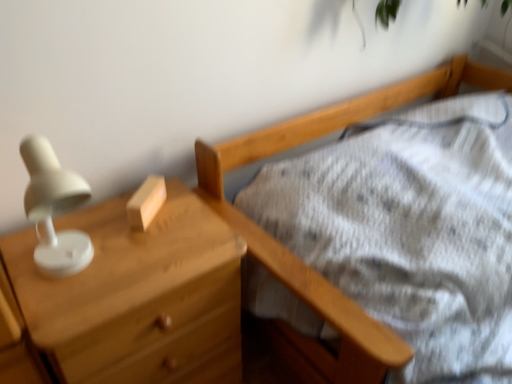
Question: Considering the relative sizes of wooden block at center and matte wood chest of drawers at left in the image provided, is wooden block at center bigger than matte wood chest of drawers at left?

Choices:
 (A) yes
 (B) no

Answer: (B)

Question: Is the depth of wooden block at center less than that of matte wood chest of drawers at left?

Choices:
 (A) no
 (B) yes

Answer: (A)

Question: Are wooden block at center and matte wood chest of drawers at left making contact?

Choices:
 (A) yes
 (B) no

Answer: (B)

Question: From the image's perspective, is wooden block at center on matte wood chest of drawers at left?

Choices:
 (A) yes
 (B) no

Answer: (A)

Question: Is matte wood chest of drawers at left located within wooden block at center?

Choices:
 (A) no
 (B) yes

Answer: (A)

Question: From a real-world perspective, is wooden block at center on top of matte wood chest of drawers at left?

Choices:
 (A) no
 (B) yes

Answer: (B)

Question: Is matte wood chest of drawers at left directly adjacent to wooden block at center?

Choices:
 (A) no
 (B) yes

Answer: (A)

Question: From a real-world perspective, does matte wood chest of drawers at left stand above wooden block at center?

Choices:
 (A) no
 (B) yes

Answer: (A)

Question: Is matte wood chest of drawers at left to the left of wooden block at center from the viewer's perspective?

Choices:
 (A) no
 (B) yes

Answer: (B)

Question: Is matte wood chest of drawers at left facing towards wooden block at center?

Choices:
 (A) no
 (B) yes

Answer: (A)

Question: Does matte wood chest of drawers at left have a greater height compared to wooden block at center?

Choices:
 (A) yes
 (B) no

Answer: (A)

Question: Considering the relative sizes of matte wood chest of drawers at left and wooden block at center in the image provided, is matte wood chest of drawers at left shorter than wooden block at center?

Choices:
 (A) no
 (B) yes

Answer: (A)

Question: Considering the positions of matte wood chest of drawers at left and wooden block at center in the image, is matte wood chest of drawers at left bigger or smaller than wooden block at center?

Choices:
 (A) big
 (B) small

Answer: (A)